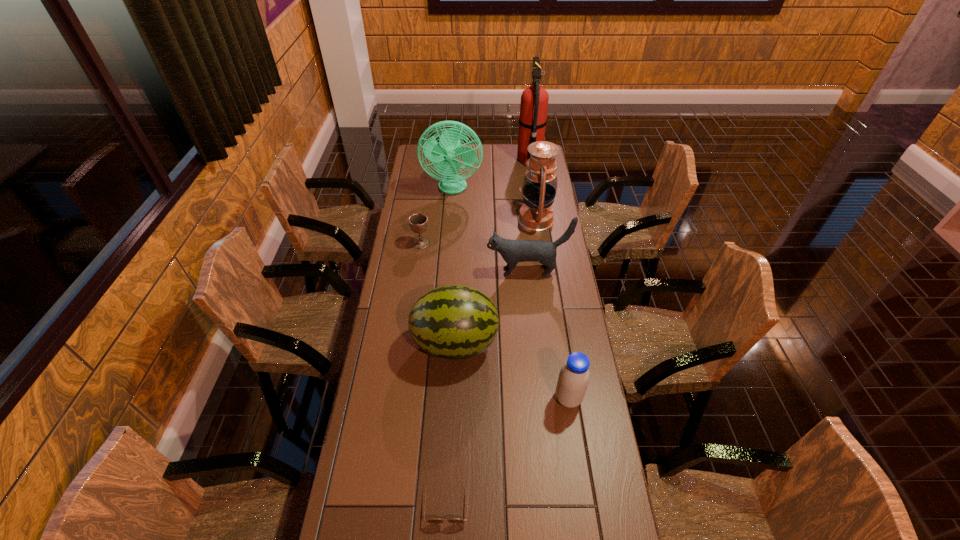
Locate which object is the closest to the fifth nearest object. Please provide its 2D coordinates. Your answer should be formatted as a tuple, i.e. [(x, y)], where the tuple contains the x and y coordinates of a point satisfying the conditions above.

[(512, 251)]

Where is `the fourth closest object to the oil lamp`? the fourth closest object to the oil lamp is located at coordinates (418, 222).

Find the location of a particular element. vacant space that satisfies the following two spatial constraints: 1. at the nozzle of the farthest object; 2. in front of the second farthest object to blow air is located at coordinates (534, 188).

Where is `free point that satisfies the following two spatial constraints: 1. at the nozzle of the farthest object; 2. on the front-facing side of the shortest object`? Image resolution: width=960 pixels, height=540 pixels. free point that satisfies the following two spatial constraints: 1. at the nozzle of the farthest object; 2. on the front-facing side of the shortest object is located at coordinates (580, 501).

Locate an element on the screen. The height and width of the screenshot is (540, 960). vacant space that satisfies the following two spatial constraints: 1. at the face of the cat; 2. on the front-facing side of the sunglasses is located at coordinates (551, 501).

Identify the location of free location that satisfies the following two spatial constraints: 1. at the nozzle of the tallest object; 2. in front of the fan to blow air. The image size is (960, 540). (534, 188).